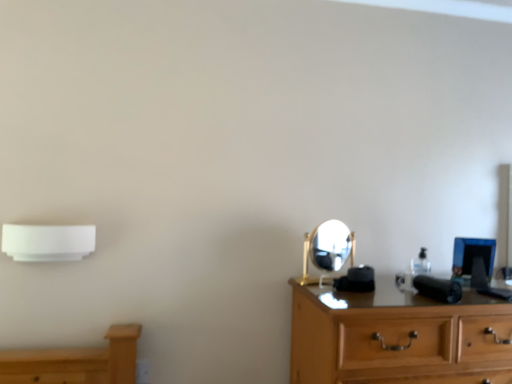
Question: From a real-world perspective, is white plastic air conditioner at left beneath wooden chest of drawers at right?

Choices:
 (A) yes
 (B) no

Answer: (B)

Question: Is wooden chest of drawers at right surrounded by white plastic air conditioner at left?

Choices:
 (A) yes
 (B) no

Answer: (B)

Question: Considering the relative sizes of white plastic air conditioner at left and wooden chest of drawers at right in the image provided, is white plastic air conditioner at left thinner than wooden chest of drawers at right?

Choices:
 (A) yes
 (B) no

Answer: (A)

Question: Is white plastic air conditioner at left further to the viewer compared to wooden chest of drawers at right?

Choices:
 (A) yes
 (B) no

Answer: (A)

Question: Can you see white plastic air conditioner at left touching wooden chest of drawers at right?

Choices:
 (A) no
 (B) yes

Answer: (A)

Question: From a real-world perspective, relative to gold metallic mirror at center, is white plastic air conditioner at left vertically above or below?

Choices:
 (A) above
 (B) below

Answer: (A)

Question: Considering the positions of point (33, 240) and point (313, 243), is point (33, 240) closer or farther from the camera than point (313, 243)?

Choices:
 (A) closer
 (B) farther

Answer: (A)

Question: Is white plastic air conditioner at left bigger or smaller than gold metallic mirror at center?

Choices:
 (A) small
 (B) big

Answer: (A)

Question: Considering the positions of white plastic air conditioner at left and gold metallic mirror at center in the image, is white plastic air conditioner at left taller or shorter than gold metallic mirror at center?

Choices:
 (A) tall
 (B) short

Answer: (B)

Question: Is gold metallic mirror at center in front of or behind white plastic air conditioner at left in the image?

Choices:
 (A) front
 (B) behind

Answer: (B)

Question: Looking at their shapes, would you say gold metallic mirror at center is wider or thinner than white plastic air conditioner at left?

Choices:
 (A) thin
 (B) wide

Answer: (A)

Question: Is gold metallic mirror at center to the left or to the right of white plastic air conditioner at left in the image?

Choices:
 (A) right
 (B) left

Answer: (A)

Question: From the image's perspective, is gold metallic mirror at center located above or below white plastic air conditioner at left?

Choices:
 (A) below
 (B) above

Answer: (A)

Question: Looking at the image, does wooden chest of drawers at right seem bigger or smaller compared to gold metallic mirror at center?

Choices:
 (A) big
 (B) small

Answer: (A)

Question: Is point (431, 339) closer or farther from the camera than point (314, 236)?

Choices:
 (A) closer
 (B) farther

Answer: (A)